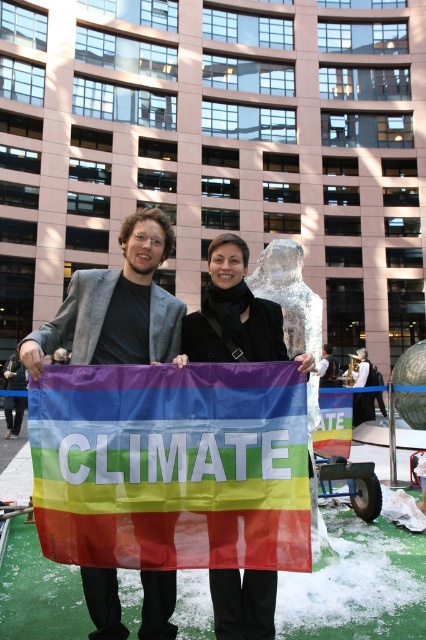
Question: Which of the following is the farthest from the observer?

Choices:
 (A) (276, 512)
 (B) (224, 355)

Answer: (B)

Question: Which object is closer to the camera taking this photo?

Choices:
 (A) black fabric coat at center
 (B) matte black jacket at center

Answer: (A)

Question: Which of the following is the closest to the observer?

Choices:
 (A) (273, 465)
 (B) (23, 356)

Answer: (A)

Question: Does black fabric coat at center come in front of matte black jacket at center?

Choices:
 (A) yes
 (B) no

Answer: (A)

Question: Does rainbow fabric flag at center appear on the right side of matte black jacket at center?

Choices:
 (A) no
 (B) yes

Answer: (A)

Question: Can you confirm if black fabric coat at center is positioned to the left of matte black jacket at center?

Choices:
 (A) yes
 (B) no

Answer: (B)